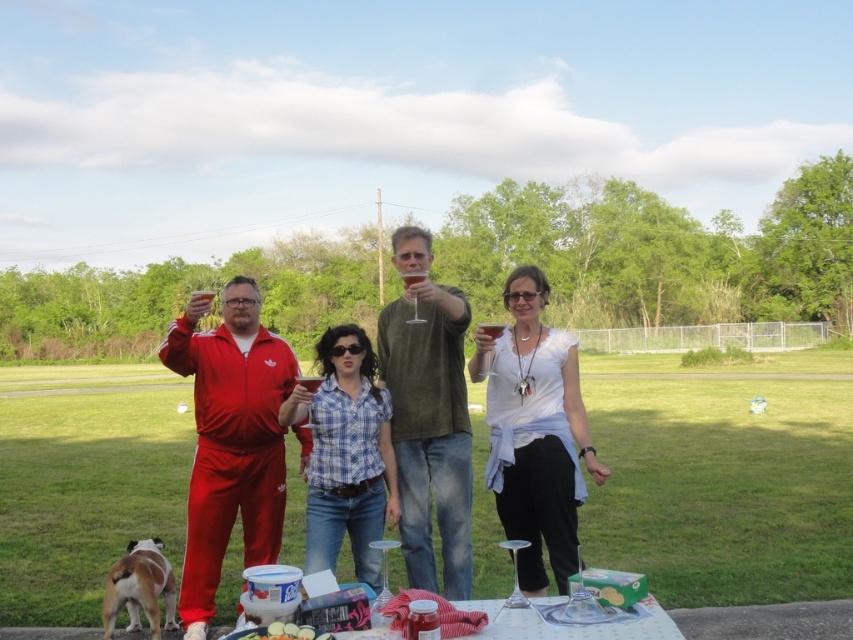
Can you confirm if green textured shirt at center is thinner than clear glassware at center?

Yes.

Who is higher up, green textured shirt at center or clear glassware at center?

green textured shirt at center

Describe the element at coordinates (428, 429) in the screenshot. The width and height of the screenshot is (853, 640). I see `green textured shirt at center` at that location.

You are a GUI agent. You are given a task and a screenshot of the screen. Output one action in this format:
    pyautogui.click(x=<x>, y=<y>)
    Task: Click on the green textured shirt at center
    
    Given the screenshot: What is the action you would take?
    pyautogui.click(x=428, y=429)

Is white cotton shirt at center shorter than clear glassware at center?

No, white cotton shirt at center is not shorter than clear glassware at center.

Find the location of `white cotton shirt at center`. white cotton shirt at center is located at coordinates (535, 433).

Does clear glassware at center lie in front of translucent glass at center?

Yes, it is.

Is clear glassware at center smaller than translucent glass at center?

Incorrect, clear glassware at center is not smaller in size than translucent glass at center.

Which is behind, point (579, 628) or point (494, 323)?

The point (494, 323) is behind.

Identify the location of clear glassware at center. (572, 625).